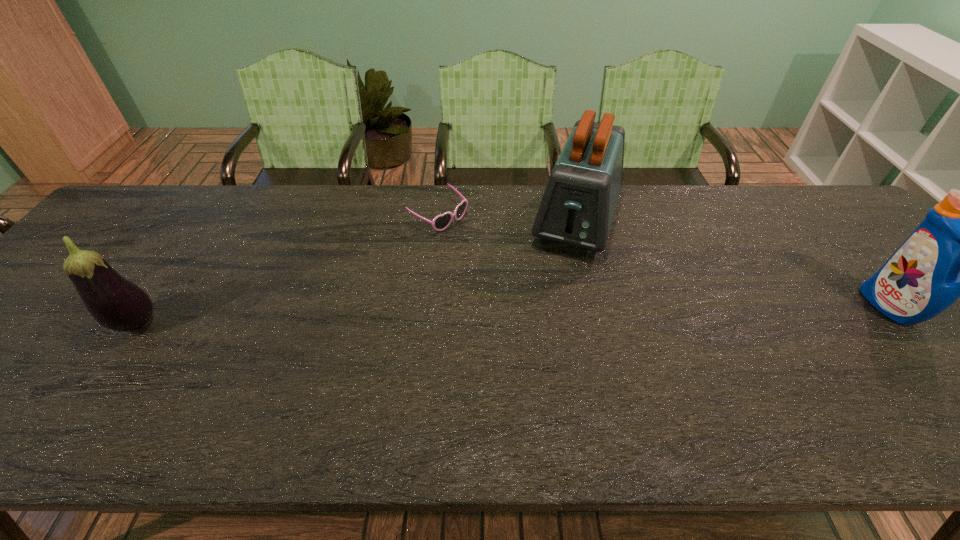
What are the coordinates of `free space at the right edge` in the screenshot? It's located at (853, 234).

What are the coordinates of `free region at the far right corner of the desktop` in the screenshot? It's located at (818, 191).

You are a GUI agent. You are given a task and a screenshot of the screen. Output one action in this format:
    pyautogui.click(x=<x>, y=<y>)
    Task: Click on the vacant space that is in between the rightmost object and the shortest object
    This screenshot has height=540, width=960.
    Given the screenshot: What is the action you would take?
    pyautogui.click(x=664, y=262)

Where is `free space between the eggplant and the rightmost object`? This screenshot has height=540, width=960. free space between the eggplant and the rightmost object is located at coordinates (514, 316).

You are a GUI agent. You are given a task and a screenshot of the screen. Output one action in this format:
    pyautogui.click(x=<x>, y=<y>)
    Task: Click on the empty location between the rightmost object and the third object from left to right
    The width and height of the screenshot is (960, 540).
    Given the screenshot: What is the action you would take?
    pyautogui.click(x=732, y=264)

You are a GUI agent. You are given a task and a screenshot of the screen. Output one action in this format:
    pyautogui.click(x=<x>, y=<y>)
    Task: Click on the free point between the third object from right to left and the rightmost object
    
    Given the screenshot: What is the action you would take?
    pyautogui.click(x=664, y=262)

Locate an element on the screen. The height and width of the screenshot is (540, 960). free space between the detergent and the shortest object is located at coordinates (664, 262).

This screenshot has height=540, width=960. I want to click on blank region between the detergent and the third object from left to right, so click(x=732, y=264).

Where is `vacant area that lies between the detergent and the shortest object`? vacant area that lies between the detergent and the shortest object is located at coordinates [x=664, y=262].

You are a GUI agent. You are given a task and a screenshot of the screen. Output one action in this format:
    pyautogui.click(x=<x>, y=<y>)
    Task: Click on the vacant space in between the rightmost object and the leftmost object
    
    Given the screenshot: What is the action you would take?
    pyautogui.click(x=514, y=316)